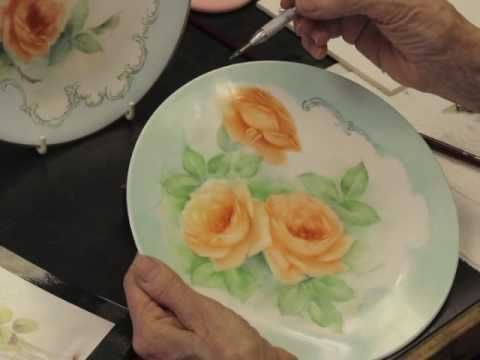
I want to click on black work table, so click(56, 200).